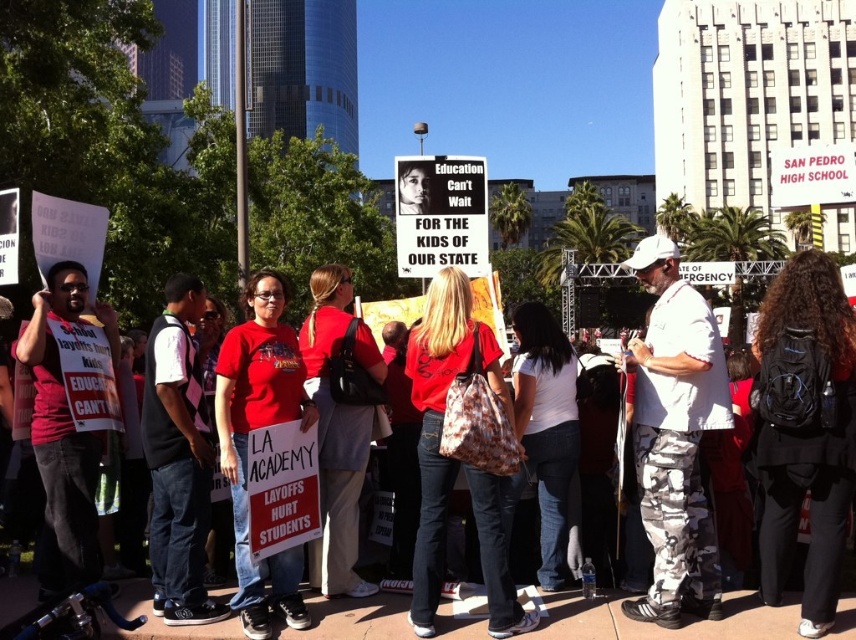
Which is more to the left, white camouflage pants at center or matte red shirt at center?

matte red shirt at center

Does white camouflage pants at center have a greater width compared to matte red shirt at center?

No.

What are the coordinates of `white camouflage pants at center` in the screenshot? It's located at (675, 436).